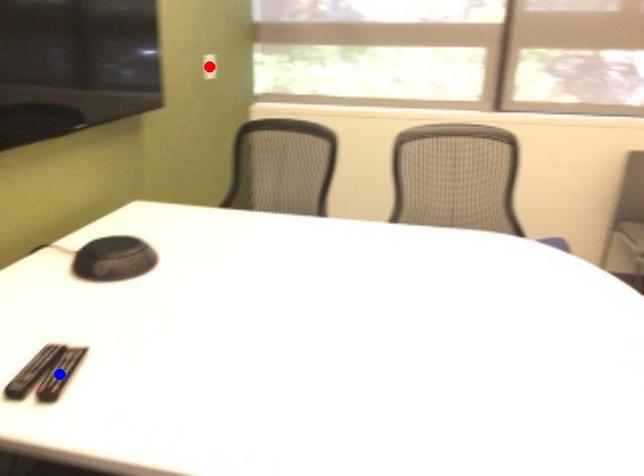
Question: Which of the two points in the image is closer to the camera?

Choices:
 (A) Blue point is closer.
 (B) Red point is closer.

Answer: (A)